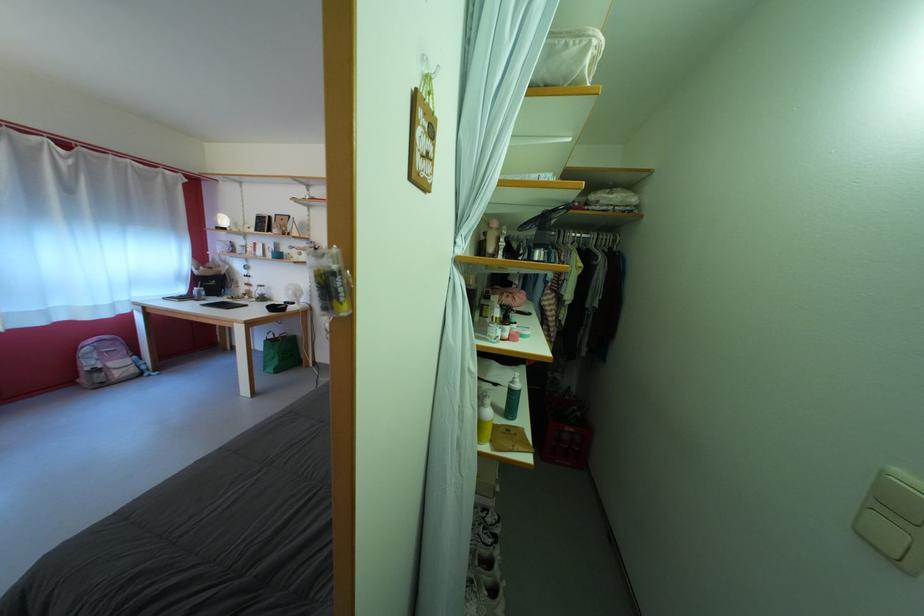
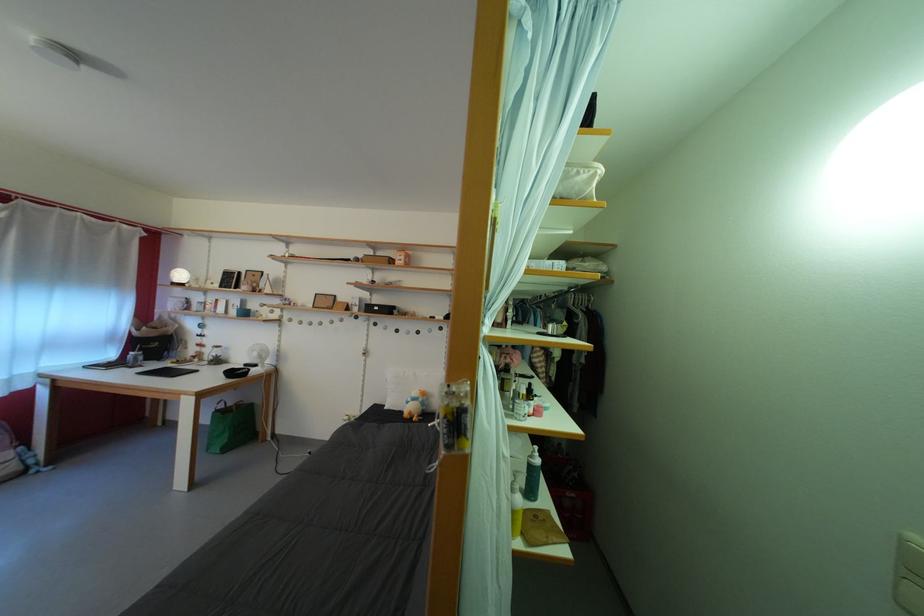
The point at [893,479] is marked in the first image. Where is the corresponding point in the second image?

(913, 545)